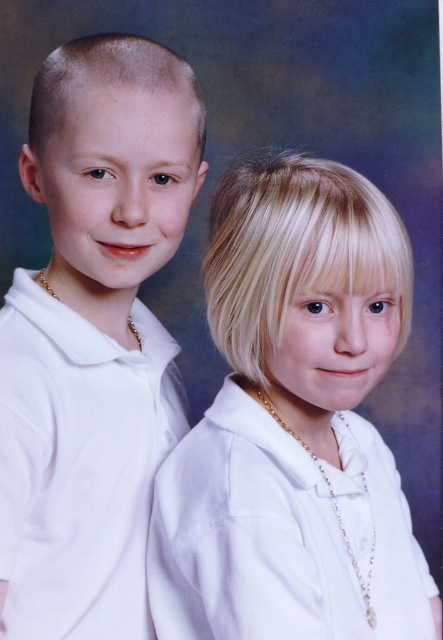
Based on the photo, you are a photographer adjusting the lighting in the studio. You need to ensure that the blonde hair at center is evenly lit. Which other object in the scene might you need to consider for adjusting the lighting to avoid shadows?

The photographer should consider the position of the girl on the right since the blonde hair at center is part of her appearance, and adjusting her position or the light source around her can help achieve even lighting without casting shadows.

You are a photographer who needs to adjust the lighting to ensure the matte white shirt at left and the blonde hair at center are both well illuminated. Based on their positions, which object should you focus the light on first to ensure proper exposure?

The blonde hair at center is located below the matte white shirt at left, so you should focus the light on the matte white shirt at left first to ensure it doesn